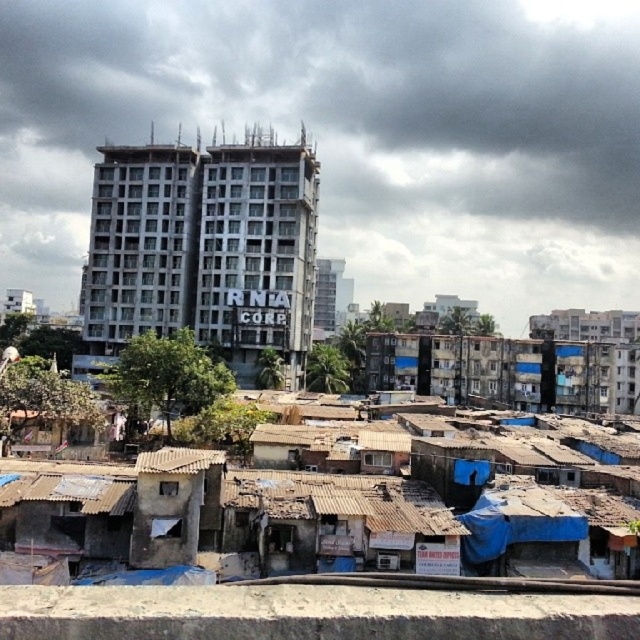
Question: Does concrete building at center appear on the right side of rusty concrete slum at lower center?

Choices:
 (A) no
 (B) yes

Answer: (A)

Question: Does white concrete building at center have a greater width compared to concrete building at center?

Choices:
 (A) yes
 (B) no

Answer: (A)

Question: Which of the following is the closest to the observer?

Choices:
 (A) concrete building at center
 (B) rusty concrete slum at lower center
 (C) white concrete building at center

Answer: (B)

Question: Which point is farther from the camera taking this photo?

Choices:
 (A) (340, 234)
 (B) (100, 209)
 (C) (388, 625)

Answer: (A)

Question: Based on their relative distances, which object is nearer to the white concrete building at center?

Choices:
 (A) rusty concrete slum at lower center
 (B) concrete building at center

Answer: (B)

Question: Does white concrete building at center come behind concrete building at center?

Choices:
 (A) yes
 (B) no

Answer: (A)